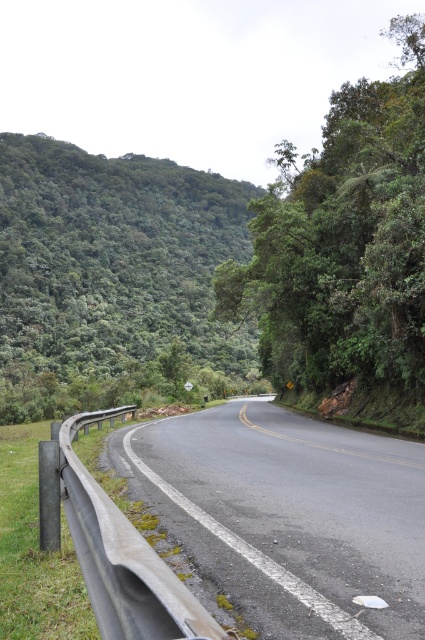
Question: Estimate the real-world distances between objects in this image. Which object is closer to the green leafy tree at upper right?

Choices:
 (A) gray metallic guardrail at left
 (B) green leafy tree at left

Answer: (A)

Question: Which of the following is the closest to the observer?

Choices:
 (A) (226, 232)
 (B) (367, 81)
 (C) (394, 538)

Answer: (C)

Question: Is green leafy tree at left thinner than gray metallic guardrail at left?

Choices:
 (A) no
 (B) yes

Answer: (A)

Question: Does gray metallic guardrail at left have a greater width compared to green leafy tree at upper right?

Choices:
 (A) no
 (B) yes

Answer: (A)

Question: Can you confirm if green leafy tree at left is smaller than gray metallic guardrail at left?

Choices:
 (A) no
 (B) yes

Answer: (A)

Question: Which object is farther from the camera taking this photo?

Choices:
 (A) green leafy tree at upper right
 (B) gray metallic guardrail at left

Answer: (A)